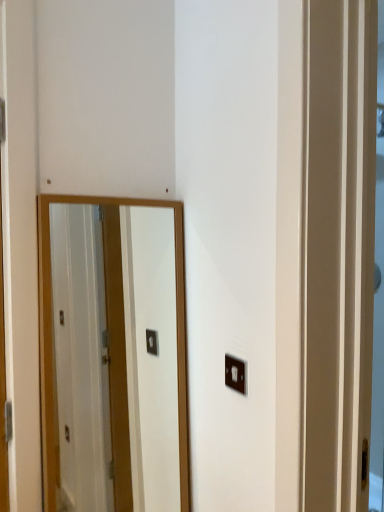
Question: Considering their positions, is matte black light switch at lower right located in front of or behind wooden-framed mirror at center?

Choices:
 (A) behind
 (B) front

Answer: (A)

Question: From the image's perspective, is matte black light switch at lower right above or below wooden-framed mirror at center?

Choices:
 (A) below
 (B) above

Answer: (B)

Question: From a real-world perspective, relative to wooden-framed mirror at center, is matte black light switch at lower right vertically above or below?

Choices:
 (A) below
 (B) above

Answer: (B)

Question: From the image's perspective, is wooden-framed mirror at center located above or below matte black light switch at lower right?

Choices:
 (A) below
 (B) above

Answer: (A)

Question: Considering the relative positions of wooden-framed mirror at center and matte black light switch at lower right in the image provided, is wooden-framed mirror at center to the left or to the right of matte black light switch at lower right?

Choices:
 (A) right
 (B) left

Answer: (B)

Question: In terms of height, does wooden-framed mirror at center look taller or shorter compared to matte black light switch at lower right?

Choices:
 (A) tall
 (B) short

Answer: (A)

Question: Is point (153, 468) positioned closer to the camera than point (244, 364)?

Choices:
 (A) closer
 (B) farther

Answer: (B)